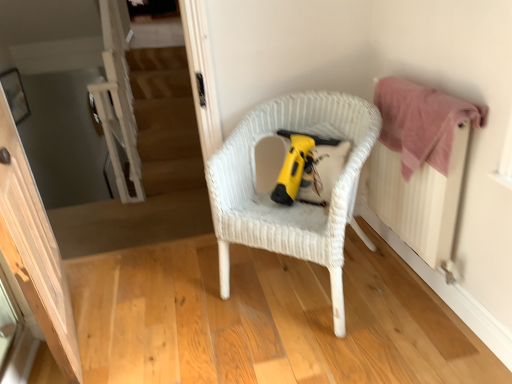
Question: From the image's perspective, is wooden floor at center located beneath white wicker chair at center?

Choices:
 (A) yes
 (B) no

Answer: (A)

Question: Does wooden floor at center have a greater height compared to white wicker chair at center?

Choices:
 (A) no
 (B) yes

Answer: (A)

Question: Are wooden floor at center and white wicker chair at center beside each other?

Choices:
 (A) no
 (B) yes

Answer: (A)

Question: Is wooden floor at center bigger than white wicker chair at center?

Choices:
 (A) no
 (B) yes

Answer: (A)

Question: Is wooden floor at center positioned with its back to white wicker chair at center?

Choices:
 (A) no
 (B) yes

Answer: (B)

Question: Is point (289, 377) positioned closer to the camera than point (407, 150)?

Choices:
 (A) farther
 (B) closer

Answer: (B)

Question: Considering the positions of wooden floor at center and pink cotton towel at upper right in the image, is wooden floor at center bigger or smaller than pink cotton towel at upper right?

Choices:
 (A) small
 (B) big

Answer: (B)

Question: Is wooden floor at center to the left or to the right of pink cotton towel at upper right in the image?

Choices:
 (A) left
 (B) right

Answer: (A)

Question: From a real-world perspective, relative to pink cotton towel at upper right, is wooden floor at center vertically above or below?

Choices:
 (A) above
 (B) below

Answer: (B)

Question: From the image's perspective, relative to yellow plastic vacuum cleaner at center, is pink fabric radiator at right above or below?

Choices:
 (A) above
 (B) below

Answer: (B)

Question: Is point (438, 183) closer or farther from the camera than point (284, 167)?

Choices:
 (A) farther
 (B) closer

Answer: (B)

Question: From a real-world perspective, is pink fabric radiator at right physically located above or below yellow plastic vacuum cleaner at center?

Choices:
 (A) above
 (B) below

Answer: (B)

Question: Considering their positions, is pink fabric radiator at right located in front of or behind yellow plastic vacuum cleaner at center?

Choices:
 (A) front
 (B) behind

Answer: (A)

Question: From the image's perspective, is white wicker chair at center located above or below yellow plastic vacuum cleaner at center?

Choices:
 (A) below
 (B) above

Answer: (A)

Question: In terms of height, does white wicker chair at center look taller or shorter compared to yellow plastic vacuum cleaner at center?

Choices:
 (A) short
 (B) tall

Answer: (B)